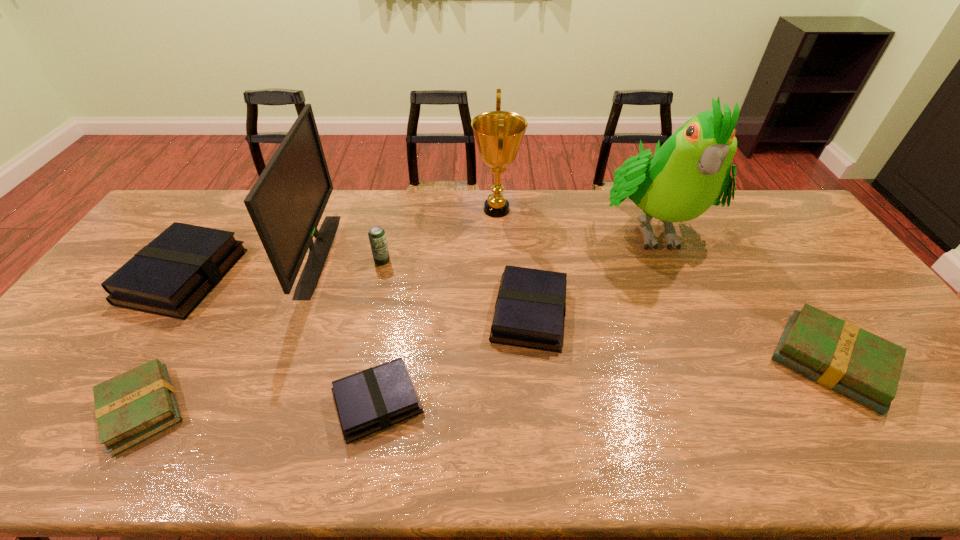
Locate an element on the screen. The height and width of the screenshot is (540, 960). free spot between the bigger yellow book and the fourth tallest object is located at coordinates (607, 311).

At what (x,y) coordinates should I click in order to perform the action: click on blank region between the smaller yellow book and the right yellow book. Please return your answer as a coordinate pair (x, y). Looking at the image, I should click on (487, 386).

Point out which object is positioned as the second nearest to the left yellow book. Please provide its 2D coordinates. Your answer should be formatted as a tuple, i.e. [(x, y)], where the tuple contains the x and y coordinates of a point satisfying the conditions above.

[(286, 203)]

Locate which object is the second closest to the right yellow book. Please provide its 2D coordinates. Your answer should be formatted as a tuple, i.e. [(x, y)], where the tuple contains the x and y coordinates of a point satisfying the conditions above.

[(530, 308)]

This screenshot has height=540, width=960. What are the coordinates of `book that is the fourth closest one to the parakeet` in the screenshot? It's located at (130, 408).

This screenshot has height=540, width=960. In order to click on book that can be found as the third closest to the rightmost blue book in this screenshot , I will do `click(130, 408)`.

This screenshot has height=540, width=960. I want to click on blue book object that ranks as the third closest to the tallest object, so click(x=170, y=276).

The width and height of the screenshot is (960, 540). I want to click on the third closest blue book to the tallest object, so click(170, 276).

Locate an element on the screen. vacant space that satisfies the following two spatial constraints: 1. on the back side of the smallest blue book; 2. on the right side of the smaller yellow book is located at coordinates (146, 402).

You are a GUI agent. You are given a task and a screenshot of the screen. Output one action in this format:
    pyautogui.click(x=<x>, y=<y>)
    Task: Click on the vacant region that satisfies the following two spatial constraints: 1. on the front side of the beer can; 2. on the left side of the second biggest blue book
    
    Given the screenshot: What is the action you would take?
    pyautogui.click(x=370, y=313)